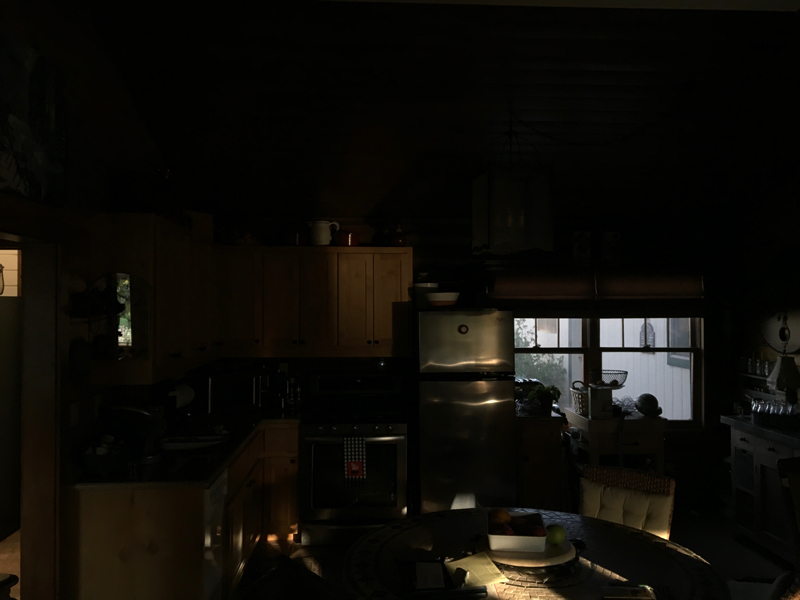
Where is `table`? Image resolution: width=800 pixels, height=600 pixels. table is located at coordinates (497, 585).